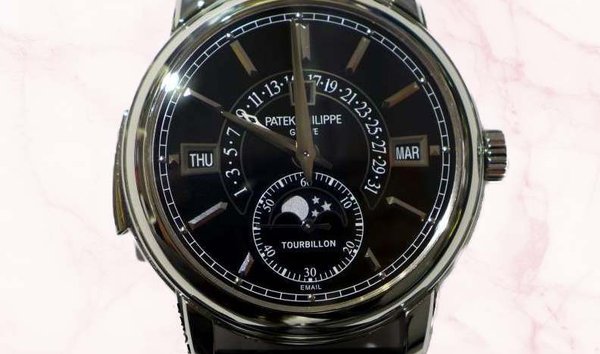
This screenshot has width=600, height=354. What are the coordinates of `marble background` in the screenshot? It's located at (564, 66).